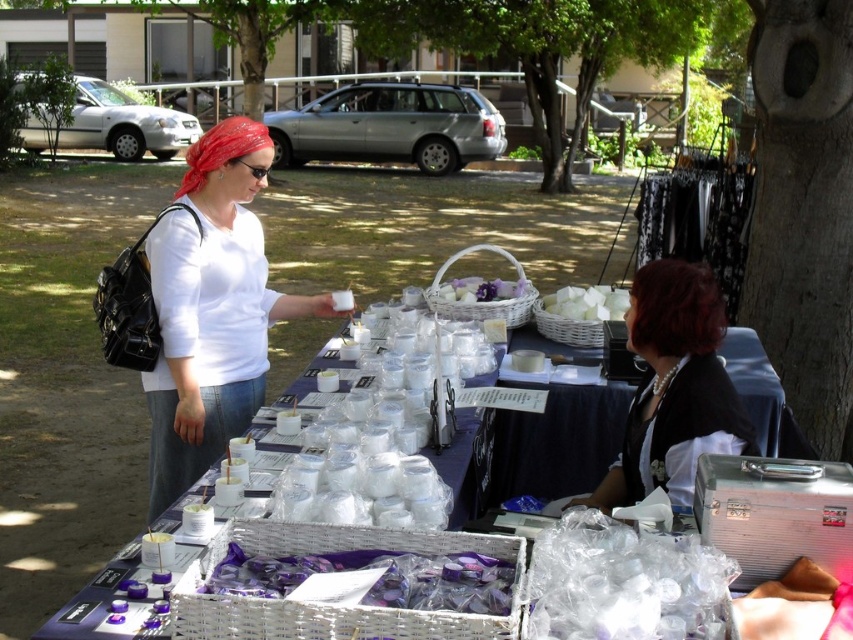
Who is more forward, (708, 273) or (376, 595)?

Positioned in front is point (376, 595).

Between pearl necklace at upper right and purple glossy candle at center, which one is positioned higher?

pearl necklace at upper right

Does point (653, 276) come closer to viewer compared to point (289, 573)?

That is False.

I want to click on pearl necklace at upper right, so pyautogui.click(x=674, y=388).

Does transparent plastic cups at lower center have a lesser height compared to shiny red bandana at upper left?

Indeed, transparent plastic cups at lower center has a lesser height compared to shiny red bandana at upper left.

What do you see at coordinates (625, 582) in the screenshot? The width and height of the screenshot is (853, 640). I see `transparent plastic cups at lower center` at bounding box center [625, 582].

Where is `transparent plastic cups at lower center`? This screenshot has width=853, height=640. transparent plastic cups at lower center is located at coordinates (625, 582).

Is point (676, 419) closer to camera compared to point (611, 577)?

No, it is behind (611, 577).

Is point (682, 448) farther from camera compared to point (630, 596)?

That is True.

Identify the location of pearl necklace at upper right. The width and height of the screenshot is (853, 640). (674, 388).